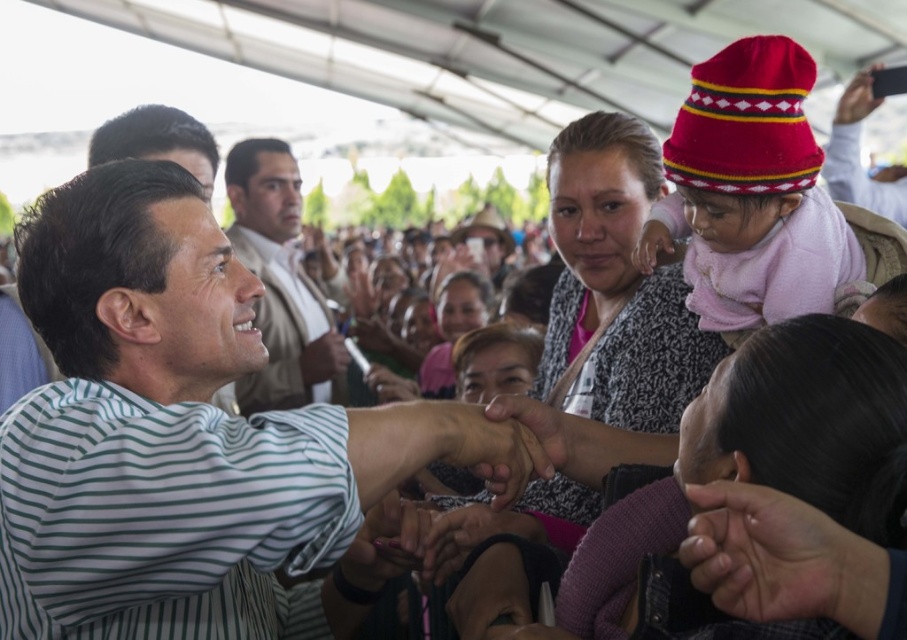
Which is more to the left, smooth beige shirt at center or smooth leather wallet at upper right?

smooth beige shirt at center

Between point (301, 316) and point (901, 179), which one is positioned in front?

Positioned in front is point (301, 316).

At what (x,y) coordinates should I click in order to perform the action: click on smooth beige shirt at center. Please return your answer as a coordinate pair (x, y). Looking at the image, I should click on (280, 282).

Which is below, white striped shirt at center or smooth beige shirt at center?

white striped shirt at center

Who is positioned more to the left, white striped shirt at center or smooth beige shirt at center?

Positioned to the left is smooth beige shirt at center.

What do you see at coordinates (179, 432) in the screenshot? I see `white striped shirt at center` at bounding box center [179, 432].

You are a GUI agent. You are given a task and a screenshot of the screen. Output one action in this format:
    pyautogui.click(x=<x>, y=<y>)
    Task: Click on the white striped shirt at center
    This screenshot has width=907, height=640.
    Given the screenshot: What is the action you would take?
    pyautogui.click(x=179, y=432)

Is point (11, 413) less distant than point (876, 196)?

Yes, point (11, 413) is closer to viewer.

Between white striped shirt at center and smooth leather wallet at upper right, which one has less height?

smooth leather wallet at upper right

The image size is (907, 640). What are the coordinates of `white striped shirt at center` in the screenshot? It's located at (179, 432).